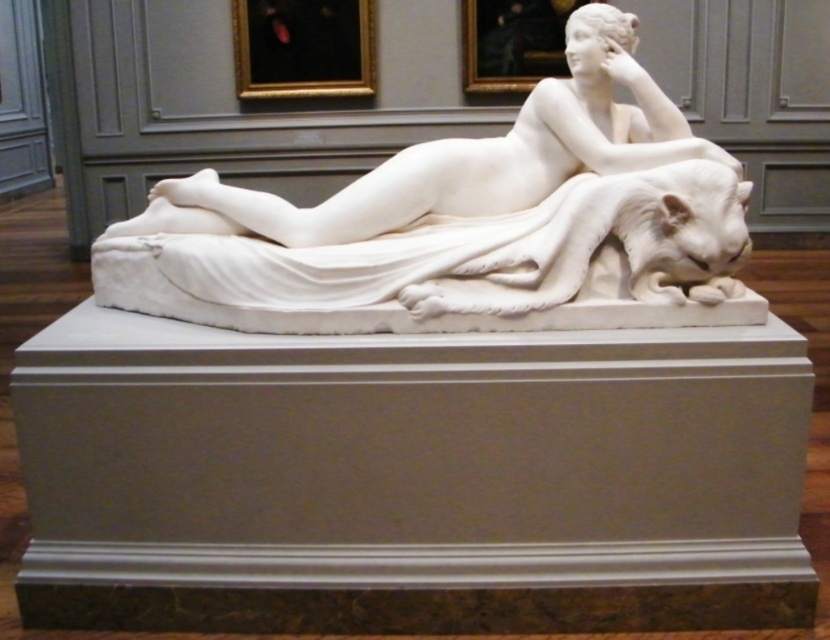
You are a visitor in the museum and want to take a photo of both the white marble sculpture at center and the white marble statue at center. However, you notice that one of them is blocking your view of the other. Which one is blocking the view of the other?

The white marble sculpture at center is closer to the viewer than the white marble statue at center, so the white marble sculpture at center is blocking the view of the white marble statue at center.

You are an art student standing in front of the white marble sculpture at center and the white marble statue at center in the museum. Which one is positioned lower in the scene?

The white marble sculpture at center is positioned lower than the white marble statue at center.

You are an art student observing the classical marble sculpture and statue at the museum. Which object is shorter between the white marble sculpture at center and the white marble statue at center?

The white marble sculpture at center is shorter than the white marble statue at center according to the description.